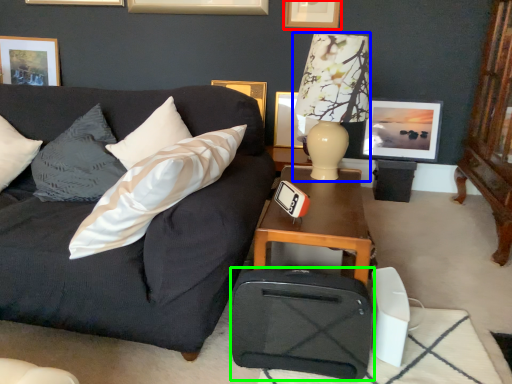
Question: Which is farther away from picture frame (highlighted by a red box)? table lamp (highlighted by a blue box) or luggage (highlighted by a green box)?

Choices:
 (A) table lamp
 (B) luggage

Answer: (B)